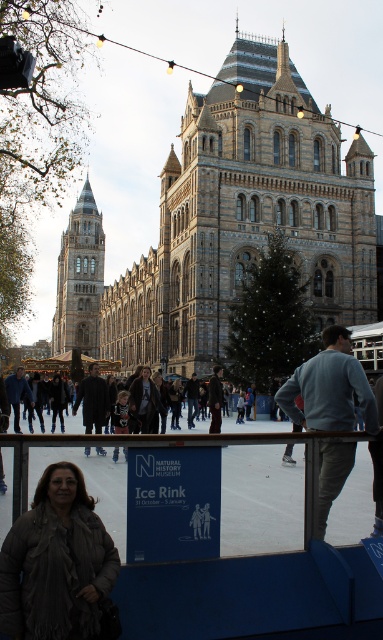
Question: Which point is farther to the camera?

Choices:
 (A) dark brown leather coat at center
 (B) dark gray sweater at center
 (C) light blue sweater at center

Answer: (A)

Question: Does golden stone tower at left lie in front of dark brown leather jacket at center?

Choices:
 (A) yes
 (B) no

Answer: (B)

Question: Which point is farther from the camera taking this photo?

Choices:
 (A) (350, 417)
 (B) (26, 385)
 (C) (26, 522)

Answer: (B)

Question: Estimate the real-world distances between objects in this image. Which object is closer to the dark gray sweater at center?

Choices:
 (A) light blue sweater at center
 (B) dark blue jacket at center
 (C) brown fuzzy coat at lower left
 (D) brown stone tower at center

Answer: (C)

Question: Is golden stone tower at left further to camera compared to dark gray sweater at center?

Choices:
 (A) no
 (B) yes

Answer: (B)

Question: Does golden stone tower at left have a lesser width compared to dark brown leather jacket at center?

Choices:
 (A) no
 (B) yes

Answer: (A)